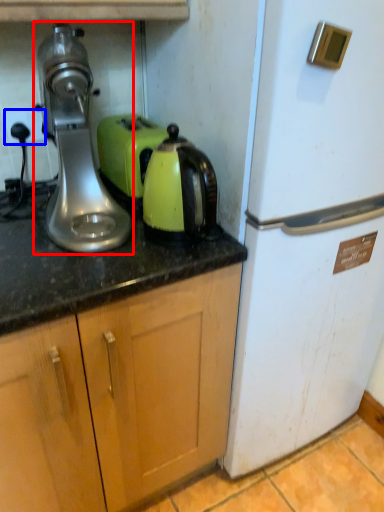
Question: Which of the following is the farthest to the observer, home appliance (highlighted by a red box) or electric outlet (highlighted by a blue box)?

Choices:
 (A) home appliance
 (B) electric outlet

Answer: (B)